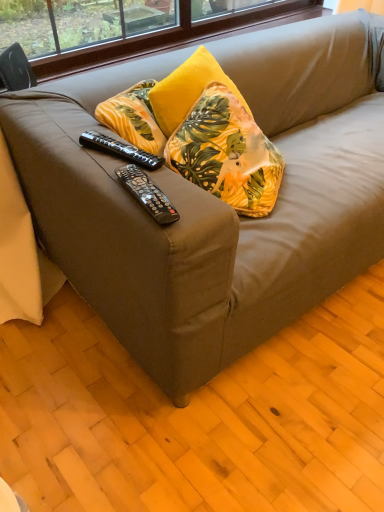
Locate an element on the screen. This screenshot has height=512, width=384. vacant region in front of black plastic remote control at center, positioned as the 2th remote control in bottom-to-top order is located at coordinates (124, 185).